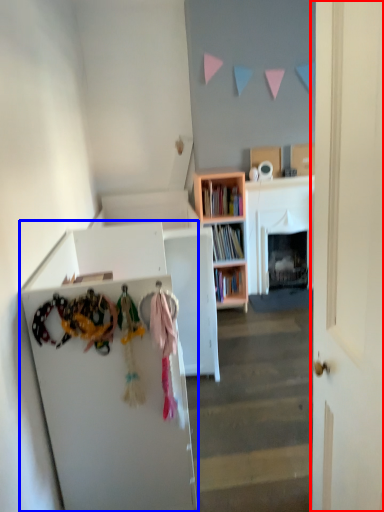
Question: Among these objects, which one is nearest to the camera, door (highlighted by a red box) or cabinetry (highlighted by a blue box)?

Choices:
 (A) door
 (B) cabinetry

Answer: (A)